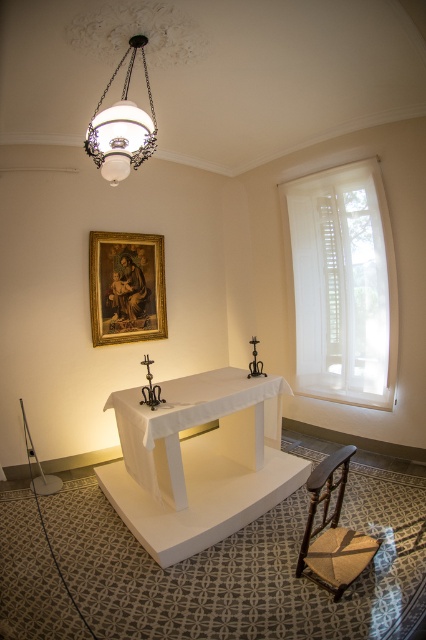
Question: Is white sheer curtain at right thinner than white matte table at center?

Choices:
 (A) no
 (B) yes

Answer: (B)

Question: Can you confirm if white matte table at center is smaller than gold-framed painting at upper center?

Choices:
 (A) yes
 (B) no

Answer: (B)

Question: Among these points, which one is farthest from the camera?

Choices:
 (A) (147, 250)
 (B) (334, 540)
 (C) (339, 301)

Answer: (A)

Question: Among these points, which one is nearest to the camera?

Choices:
 (A) (345, 573)
 (B) (134, 332)

Answer: (A)

Question: Which is nearer to the white glass lampshade at upper center?

Choices:
 (A) white sheer curtain at right
 (B) white matte table at center

Answer: (B)

Question: Is the position of white sheer curtain at right more distant than that of white glass lampshade at upper center?

Choices:
 (A) yes
 (B) no

Answer: (A)